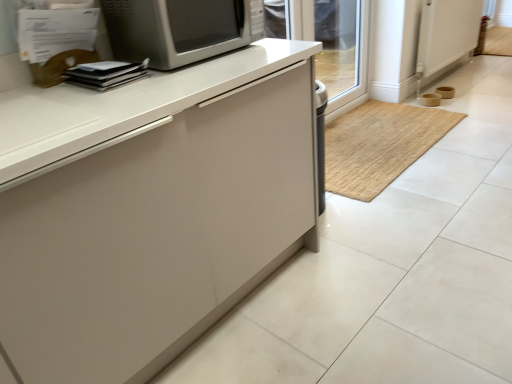
Identify the location of space that is in front of white plastic screen door at upper right. The height and width of the screenshot is (384, 512). (447, 97).